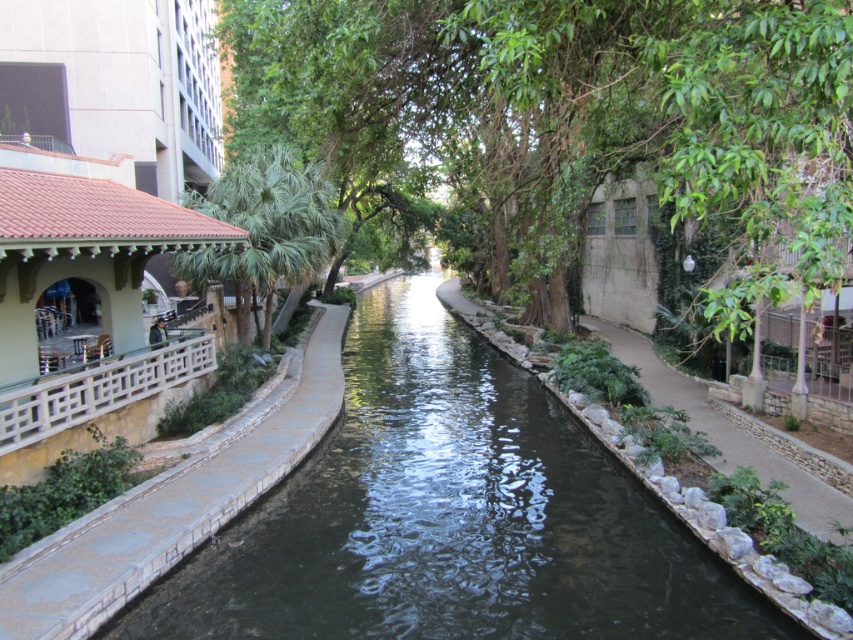
Question: Does green leafy tree at left appear under green stone wall at right?

Choices:
 (A) no
 (B) yes

Answer: (A)

Question: Can you confirm if green leafy tree at left is positioned to the left of green stone wall at right?

Choices:
 (A) yes
 (B) no

Answer: (A)

Question: Is green leafy tree at center closer to camera compared to green leafy tree at left?

Choices:
 (A) yes
 (B) no

Answer: (A)

Question: Estimate the real-world distances between objects in this image. Which object is closer to the green leafy tree at left?

Choices:
 (A) green leafy tree at center
 (B) dark concrete stream at center
 (C) green stone wall at right

Answer: (A)

Question: Among these objects, which one is farthest from the camera?

Choices:
 (A) dark concrete stream at center
 (B) green leafy tree at center
 (C) green stone wall at right

Answer: (C)

Question: Which of the following is the farthest from the observer?

Choices:
 (A) (587, 125)
 (B) (497, 477)
 (C) (189, 275)
 (D) (796, 522)

Answer: (C)